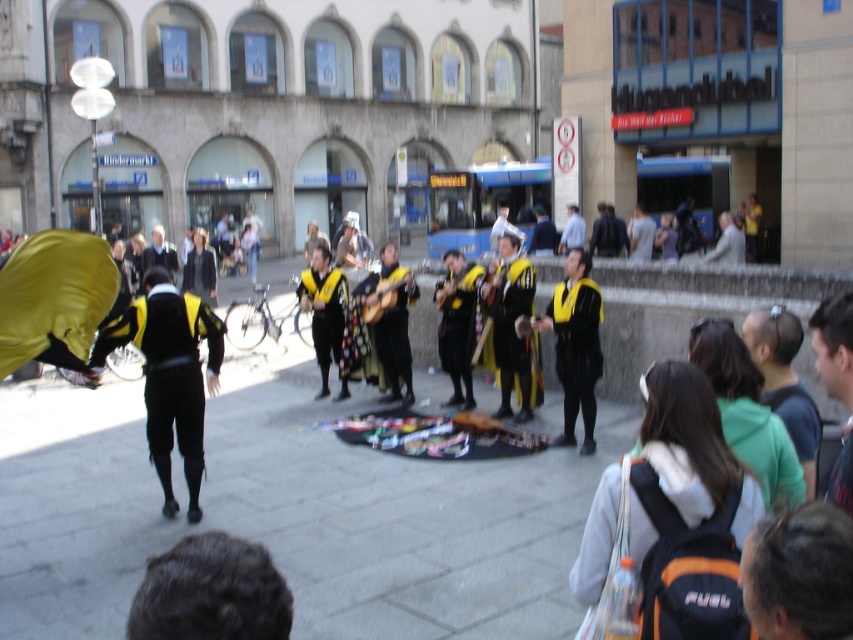
In the scene shown: You are a photographer trying to capture the performer wearing the matte black coat at center. Given that your camera has a focal length of 50mm and you want to ensure the coat is in the center of the frame, what coordinates should you aim for?

The coordinates to aim for are point (160, 253), as that is where the matte black coat at center is positioned.

You are a spectator at the street performance and want to find the black velvet jacket at center. Which direction should you look relative to the black leather jacket at center?

The black velvet jacket at center is to the left of the black leather jacket at center, so you should look to the left of the black leather jacket at center to find it.